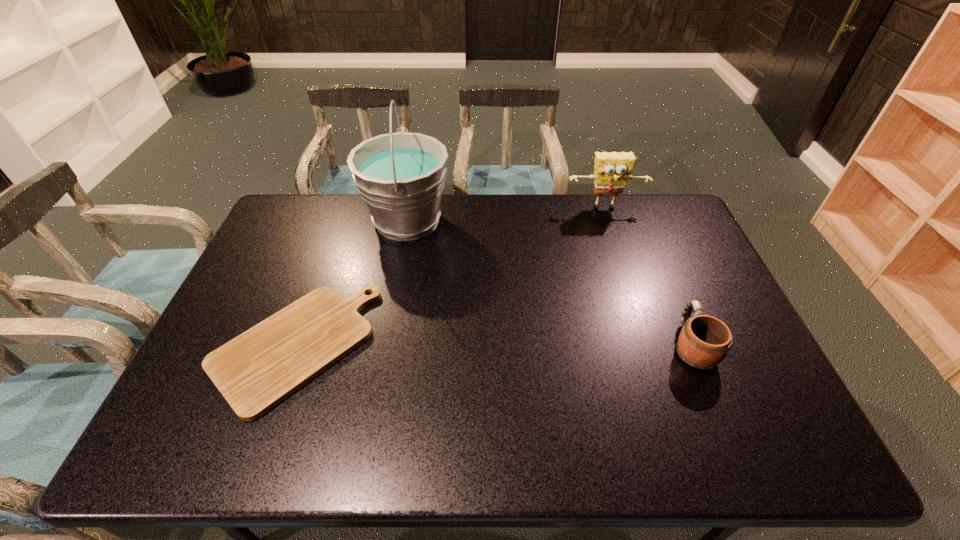
Image resolution: width=960 pixels, height=540 pixels. In order to click on bucket that is positioned at the far edge in this screenshot , I will do `click(400, 176)`.

Where is `sponge that is at the far edge`? The height and width of the screenshot is (540, 960). sponge that is at the far edge is located at coordinates (612, 170).

You are a GUI agent. You are given a task and a screenshot of the screen. Output one action in this format:
    pyautogui.click(x=<x>, y=<y>)
    Task: Click on the object at the left edge
    This screenshot has width=960, height=540.
    Given the screenshot: What is the action you would take?
    pyautogui.click(x=260, y=368)

Find the location of a particular element. This screenshot has width=960, height=540. sponge located at the right edge is located at coordinates (612, 170).

Where is `mug present at the right edge`? mug present at the right edge is located at coordinates (704, 340).

In order to click on object at the far right corner in this screenshot , I will do `click(612, 170)`.

You are a GUI agent. You are given a task and a screenshot of the screen. Output one action in this format:
    pyautogui.click(x=<x>, y=<y>)
    Task: Click on the blank space at the far edge of the desktop
    Image resolution: width=960 pixels, height=540 pixels.
    Given the screenshot: What is the action you would take?
    pyautogui.click(x=603, y=210)

What are the coordinates of `free region at the near edge of the desktop` in the screenshot? It's located at (411, 443).

Image resolution: width=960 pixels, height=540 pixels. In order to click on blank space at the right edge of the desktop in this screenshot , I will do `click(756, 392)`.

Identify the location of free spot between the second shortest object and the bucket. This screenshot has height=540, width=960. (550, 283).